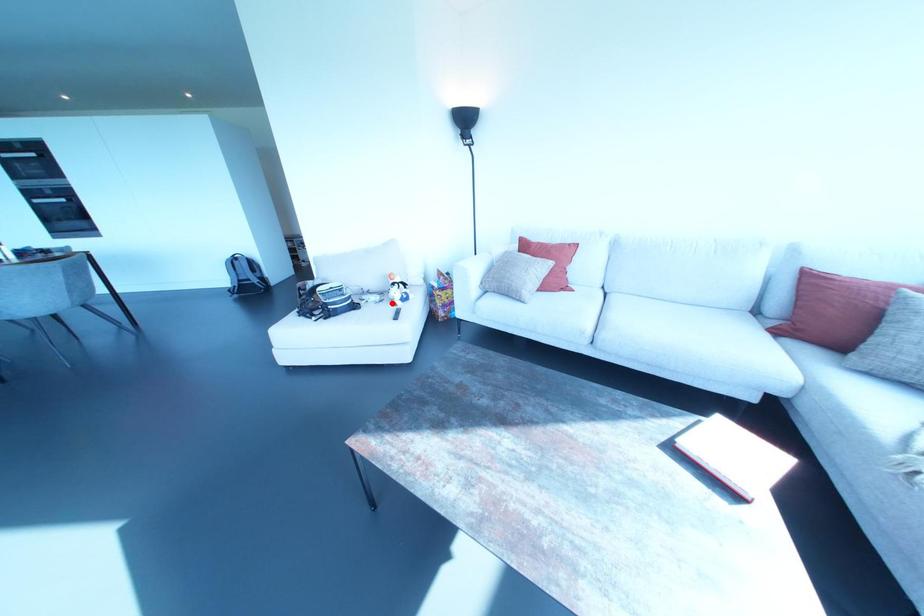
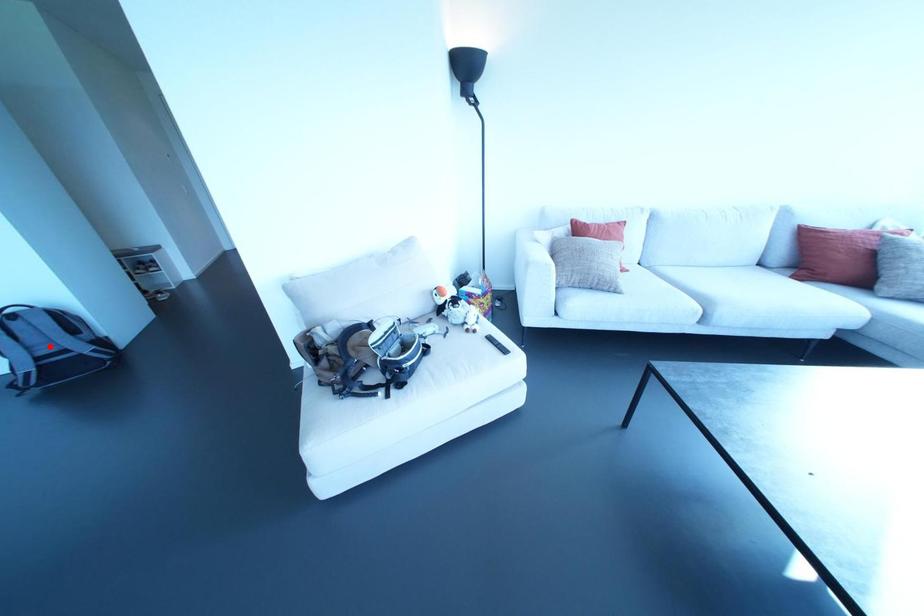
I am providing you with two images of the same scene from different viewpoints. A red point is marked on the first image and another point is marked on the second image. Do the highlighted points in image1 and image2 indicate the same real-world spot?

No